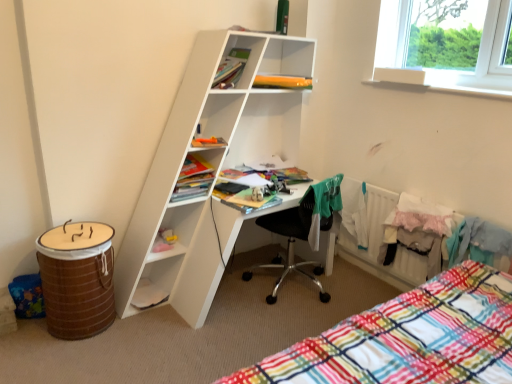
The width and height of the screenshot is (512, 384). In order to click on vacant area that is in front of black mesh chair at center in this screenshot , I will do `click(278, 325)`.